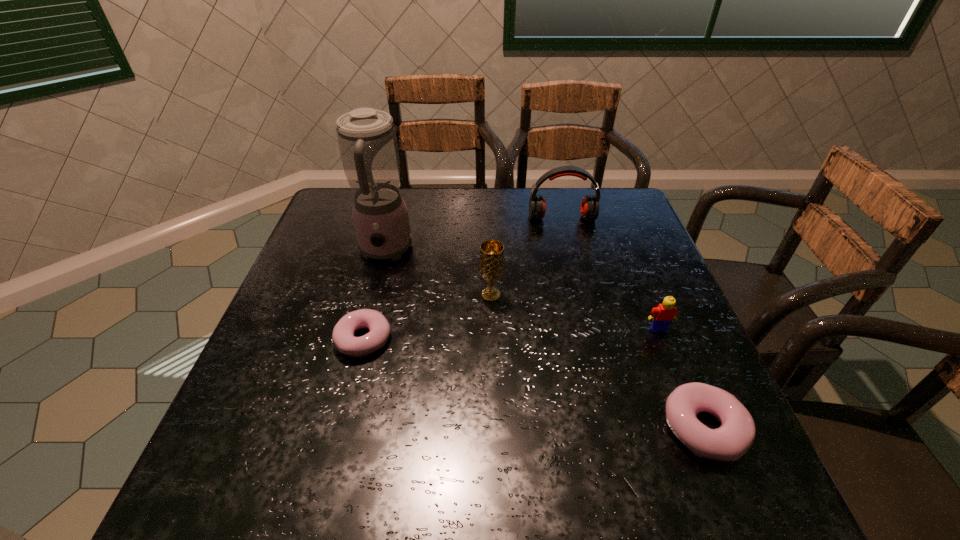
This screenshot has height=540, width=960. Find the location of `the shorter doughnut`. the shorter doughnut is located at coordinates (343, 339).

Find the location of a particular element. the left doughnut is located at coordinates (343, 339).

Where is `the taller doughnut`? the taller doughnut is located at coordinates (729, 442).

Where is `the fifth tallest object`? the fifth tallest object is located at coordinates (729, 442).

Locate an element on the screen. The height and width of the screenshot is (540, 960). earphone is located at coordinates (589, 209).

Image resolution: width=960 pixels, height=540 pixels. Identify the location of the third shortest object. (661, 316).

This screenshot has height=540, width=960. Identify the location of the tallest object. (367, 141).

Locate an element on the screen. Image resolution: width=960 pixels, height=540 pixels. food processor is located at coordinates (367, 141).

Find the location of a particular element. The image size is (960, 540). chalice is located at coordinates (491, 264).

Identify the location of the fourth object from right to left. (491, 264).